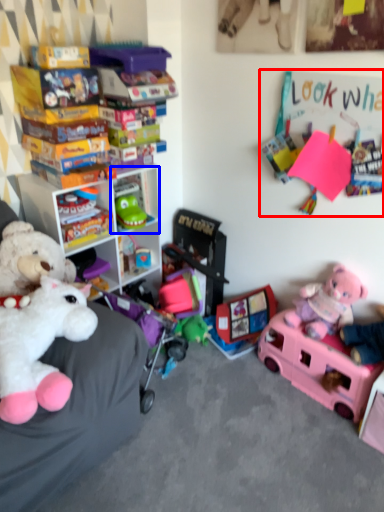
Question: Which object appears closest to the camera in this image, bulletin board (highlighted by a red box) or shelf (highlighted by a blue box)?

Choices:
 (A) bulletin board
 (B) shelf

Answer: (A)